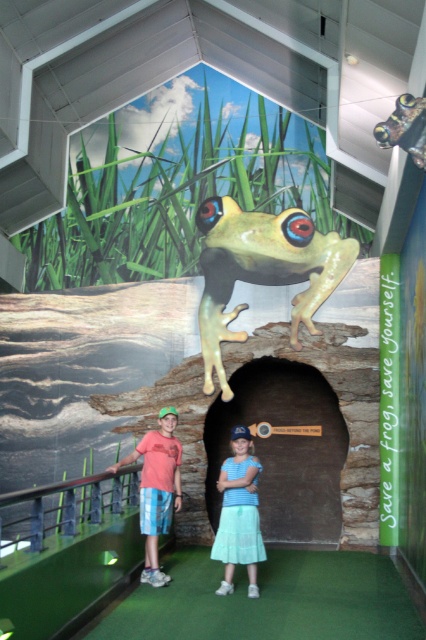
Who is lower down, green rubber frog at center or matte coral t-shirt at center?

matte coral t-shirt at center

Is point (203, 348) farther from viewer compared to point (161, 422)?

Yes, it is behind point (161, 422).

Find the location of a particular element. green rubber frog at center is located at coordinates click(x=261, y=269).

Does light blue fabric skirt at center appear under matte coral t-shirt at center?

Indeed, light blue fabric skirt at center is positioned under matte coral t-shirt at center.

Which is behind, point (242, 451) or point (173, 472)?

The point (173, 472) is more distant.

In order to click on light blue fabric skirt at center in this screenshot , I will do `click(238, 513)`.

Who is shorter, green rubber frog at center or light blue fabric skirt at center?

Standing shorter between the two is light blue fabric skirt at center.

Is the position of green rubber frog at center less distant than that of light blue fabric skirt at center?

No, it is behind light blue fabric skirt at center.

Between point (291, 236) and point (224, 472), which one is positioned behind?

The point (291, 236) is behind.

Locate an element on the screen. The width and height of the screenshot is (426, 640). green rubber frog at center is located at coordinates (261, 269).